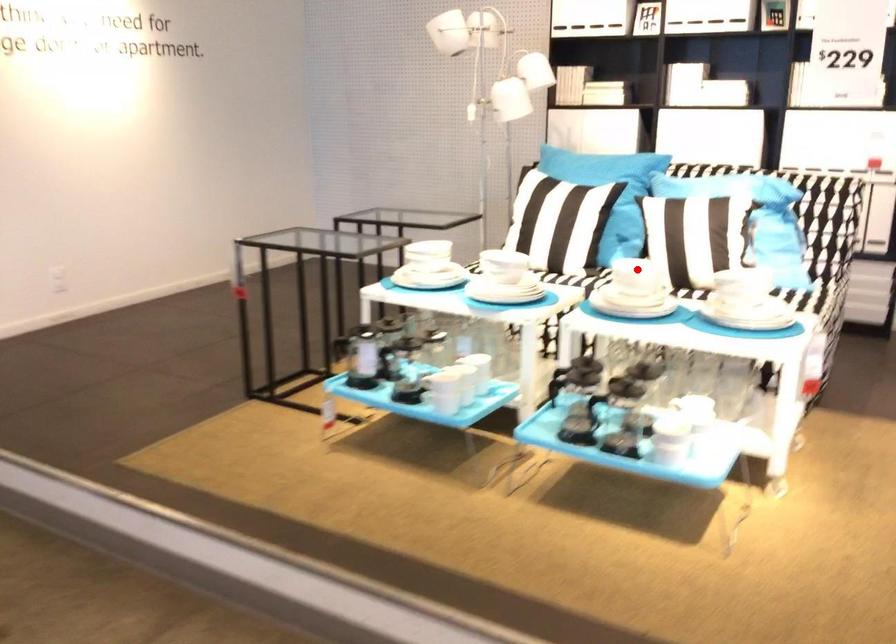
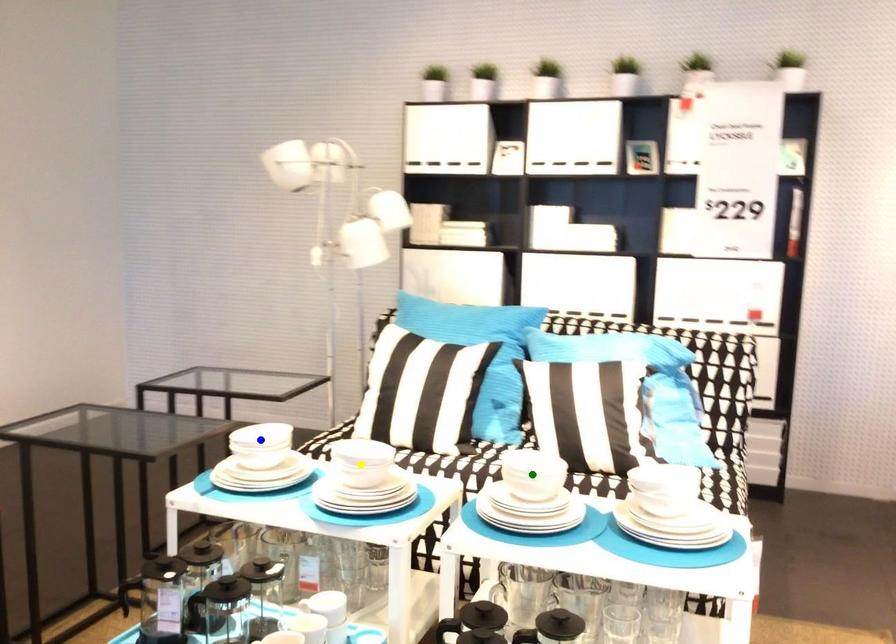
Question: I am providing you with two images of the same scene from different viewpoints. A red point is marked on the first image. You are given multiple points on the second image. Which point in image 2 represents the same 3d spot as the red point in image 1?

Choices:
 (A) yellow point
 (B) green point
 (C) blue point

Answer: (B)